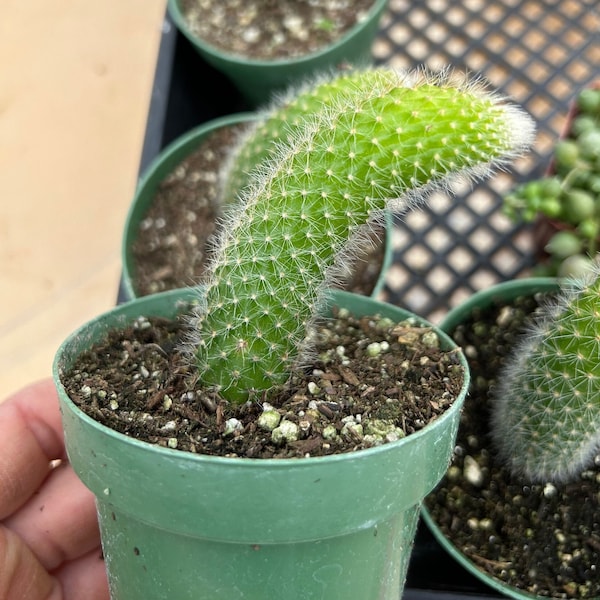
Identify the location of pot. (269, 76).